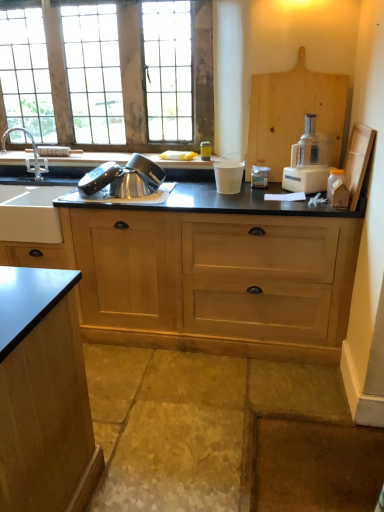
The image size is (384, 512). Identify the location of black matte countertop at center. (208, 272).

This screenshot has height=512, width=384. Describe the element at coordinates (108, 74) in the screenshot. I see `wooden window at upper left` at that location.

I want to click on silver metallic faucet at left, so (x=27, y=158).

Is metallic silver colander at sink positioned in front of white plastic food processor at right?

That is False.

Considering the sizes of objects metallic silver colander at sink and white plastic food processor at right in the image provided, who is taller, metallic silver colander at sink or white plastic food processor at right?

white plastic food processor at right is taller.

Considering the sizes of metallic silver colander at sink and white plastic food processor at right in the image, is metallic silver colander at sink wider or thinner than white plastic food processor at right?

Considering their sizes, metallic silver colander at sink looks slimmer than white plastic food processor at right.

Is metallic silver colander at sink positioned beyond the bounds of white plastic food processor at right?

Absolutely, metallic silver colander at sink is external to white plastic food processor at right.

Which object is positioned more to the left, wooden window at upper left or silver metallic faucet at left?

From the viewer's perspective, silver metallic faucet at left appears more on the left side.

At what (x,y) coordinates should I click in order to perform the action: click on window above the silver metallic faucet at left (from a real-world perspective). Please return your answer as a coordinate pair (x, y). Image resolution: width=384 pixels, height=512 pixels. Looking at the image, I should click on (108, 74).

Which is closer to the camera, (62,59) or (7,132)?

Point (62,59)

Are wooden window at upper left and silver metallic faucet at left located far from each other?

No, there isn't a large distance between wooden window at upper left and silver metallic faucet at left.

What's the angular difference between black matte countertop at center and wooden window at upper left's facing directions?

The angular difference between black matte countertop at center and wooden window at upper left is 1.26 degrees.

The height and width of the screenshot is (512, 384). What are the coordinates of `window above the black matte countertop at center (from a real-world perspective)` in the screenshot? It's located at (108, 74).

Is black matte countertop at center next to wooden window at upper left and touching it?

No, black matte countertop at center is not next to wooden window at upper left.

Do you think black matte countertop at center is within wooden window at upper left, or outside of it?

black matte countertop at center is outside wooden window at upper left.

At what (x,y) coordinates should I click in order to perform the action: click on countertop that is in front of the silver metallic faucet at left. Please return your answer as a coordinate pair (x, y). This screenshot has height=512, width=384. Looking at the image, I should click on (208, 272).

Considering the sizes of black matte countertop at center and silver metallic faucet at left in the image, is black matte countertop at center bigger or smaller than silver metallic faucet at left?

black matte countertop at center is bigger than silver metallic faucet at left.

From a real-world perspective, which is physically below, black matte countertop at center or silver metallic faucet at left?

black matte countertop at center.

Can you confirm if black matte countertop at center is shorter than silver metallic faucet at left?

No, black matte countertop at center is not shorter than silver metallic faucet at left.

Is white plastic food processor at right at the left side of silver metallic faucet at left?

Incorrect, white plastic food processor at right is not on the left side of silver metallic faucet at left.

From the image's perspective, which object appears higher, white plastic food processor at right or silver metallic faucet at left?

silver metallic faucet at left is shown above in the image.

Considering the sizes of objects white plastic food processor at right and silver metallic faucet at left in the image provided, who is bigger, white plastic food processor at right or silver metallic faucet at left?

Bigger between the two is white plastic food processor at right.

The height and width of the screenshot is (512, 384). Find the location of `tap located underneath the white plastic food processor at right (from a real-world perspective)`. tap located underneath the white plastic food processor at right (from a real-world perspective) is located at coordinates (27, 158).

Considering the positions of objects silver metallic faucet at left and metallic silver colander at sink in the image provided, who is behind, silver metallic faucet at left or metallic silver colander at sink?

silver metallic faucet at left is further away from the camera.

Is metallic silver colander at sink at the back of silver metallic faucet at left?

silver metallic faucet at left does not have its back to metallic silver colander at sink.

This screenshot has height=512, width=384. I want to click on tap located above the metallic silver colander at sink (from a real-world perspective), so click(27, 158).

From a real-world perspective, relative to metallic silver colander at sink, is silver metallic faucet at left vertically above or below?

silver metallic faucet at left is above metallic silver colander at sink.

Considering the positions of points (205, 190) and (128, 176), is point (205, 190) farther from camera compared to point (128, 176)?

Yes, point (205, 190) is behind point (128, 176).

Considering the positions of objects black matte countertop at center and metallic silver colander at sink in the image provided, who is more to the left, black matte countertop at center or metallic silver colander at sink?

black matte countertop at center is more to the left.

How different are the orientations of black matte countertop at center and metallic silver colander at sink in degrees?

black matte countertop at center and metallic silver colander at sink are facing 0.216 degrees away from each other.

Find the location of a particular element. Image resolution: width=384 pixels, height=512 pixels. appliance that is below the white plastic food processor at right (from the image's perspective) is located at coordinates (124, 178).

Where is `window above the silver metallic faucet at left (from a real-world perspective)`? This screenshot has width=384, height=512. window above the silver metallic faucet at left (from a real-world perspective) is located at coordinates (108, 74).

Which object lies nearer to the anchor point white plastic food processor at right, metallic silver colander at sink or wooden window at upper left?

Based on the image, metallic silver colander at sink appears to be nearer to white plastic food processor at right.

Considering their positions, is white plastic food processor at right positioned further to metallic silver colander at sink than wooden window at upper left?

white plastic food processor at right lies further to metallic silver colander at sink than the other object.

Based on their spatial positions, is silver metallic faucet at left or black matte countertop at center further from metallic silver colander at sink?

Among the two, silver metallic faucet at left is located further to metallic silver colander at sink.

Which object lies nearer to the anchor point wooden window at upper left, white plastic food processor at right or black matte countertop at center?

black matte countertop at center is closer to wooden window at upper left.

Looking at the image, which one is located closer to white plastic food processor at right, silver metallic faucet at left or metallic silver colander at sink?

metallic silver colander at sink lies closer to white plastic food processor at right than the other object.

When comparing their distances from metallic silver colander at sink, does wooden window at upper left or black matte countertop at center seem further?

wooden window at upper left.

Considering their positions, is wooden window at upper left positioned further to white plastic food processor at right than silver metallic faucet at left?

The object further to white plastic food processor at right is silver metallic faucet at left.

Considering their positions, is wooden window at upper left positioned closer to black matte countertop at center than white plastic food processor at right?

Based on the image, white plastic food processor at right appears to be nearer to black matte countertop at center.

This screenshot has width=384, height=512. Identify the location of tap between wooden window at upper left and black matte countertop at center vertically. (27, 158).

Where is `appliance between wooden window at upper left and black matte countertop at center in the up-down direction`? This screenshot has height=512, width=384. appliance between wooden window at upper left and black matte countertop at center in the up-down direction is located at coordinates (124, 178).

This screenshot has width=384, height=512. In order to click on window located between silver metallic faucet at left and white plastic food processor at right in the left-right direction in this screenshot , I will do `click(108, 74)`.

Identify the location of countertop situated between silver metallic faucet at left and metallic silver colander at sink from left to right. This screenshot has width=384, height=512. (208, 272).